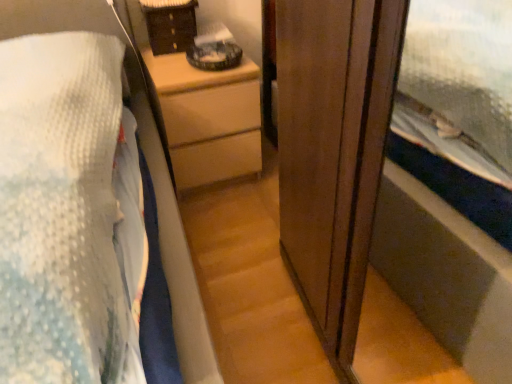
The image size is (512, 384). I want to click on unoccupied area in front of brown woven basket at upper center, so click(165, 61).